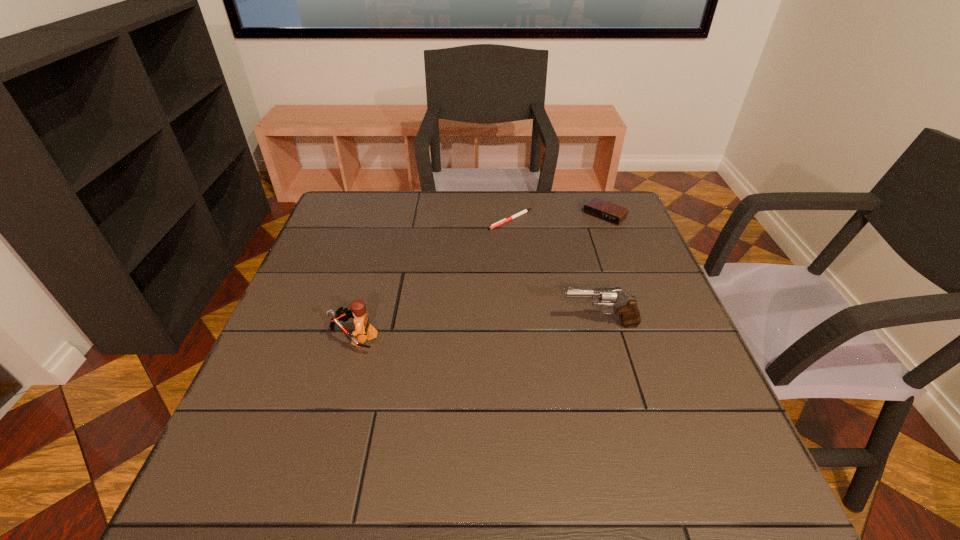
Locate an element on the screen. The image size is (960, 540). the leftmost object is located at coordinates (363, 328).

Where is `pistol`? pistol is located at coordinates (626, 306).

At what (x,y) coordinates should I click in order to perform the action: click on pen. Please return your answer as a coordinate pair (x, y). This screenshot has width=960, height=540. Looking at the image, I should click on (505, 220).

Find the location of `the shortest object`. the shortest object is located at coordinates (505, 220).

Image resolution: width=960 pixels, height=540 pixels. In order to click on alarm clock in this screenshot , I will do `click(598, 208)`.

The width and height of the screenshot is (960, 540). Identify the location of vacant space located 0.120m holding a crossbow in the hands of the Lego. (277, 338).

Image resolution: width=960 pixels, height=540 pixels. In order to click on vacant space located at the barrel of the pistol in this screenshot , I will do `click(457, 325)`.

Locate an element on the screen. The image size is (960, 540). free region located at the barrel of the pistol is located at coordinates (535, 325).

The height and width of the screenshot is (540, 960). In order to click on vacant space located at the barrel of the pistol in this screenshot , I will do [404, 325].

Identify the location of free space located 0.370m on the clicker of the second object from left to right. This screenshot has width=960, height=540. (459, 316).